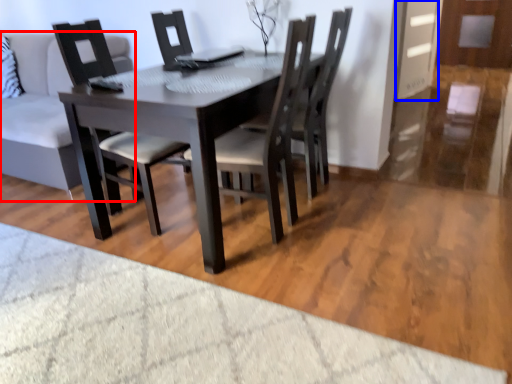
Question: Which object appears farthest to the camera in this image, studio couch (highlighted by a red box) or glass door (highlighted by a blue box)?

Choices:
 (A) studio couch
 (B) glass door

Answer: (B)